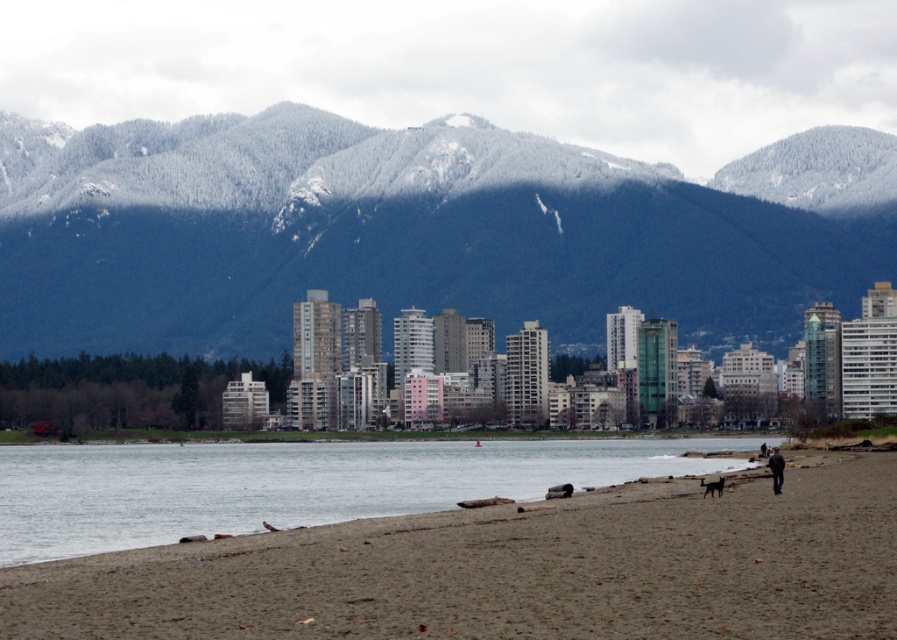
Does point (186, 602) come behind point (767, 465)?

No, it is in front of (767, 465).

Does brown sandy beach at lower center come in front of dark blue jacket at lower right?

Yes, brown sandy beach at lower center is closer to the viewer.

Does point (173, 552) come behind point (776, 449)?

No, (173, 552) is closer to viewer.

Locate an element on the screen. The height and width of the screenshot is (640, 897). brown sandy beach at lower center is located at coordinates (512, 570).

Identify the location of snowy forested mountain at upper center. 417,228.

Between snowy forested mountain at upper center and brown sandy beach at lower center, which one has more height?

snowy forested mountain at upper center is taller.

Is point (118, 212) more distant than point (92, 605)?

Yes.

Identify the location of snowy forested mountain at upper center. (417, 228).

Can you confirm if snowy forested mountain at upper center is positioned below dark blue jacket at lower right?

Actually, snowy forested mountain at upper center is above dark blue jacket at lower right.

Does snowy forested mountain at upper center have a smaller size compared to dark blue jacket at lower right?

Incorrect, snowy forested mountain at upper center is not smaller in size than dark blue jacket at lower right.

Between point (449, 141) and point (771, 461), which one is positioned behind?

The point (449, 141) is more distant.

Locate an element on the screen. The image size is (897, 640). snowy forested mountain at upper center is located at coordinates (417, 228).